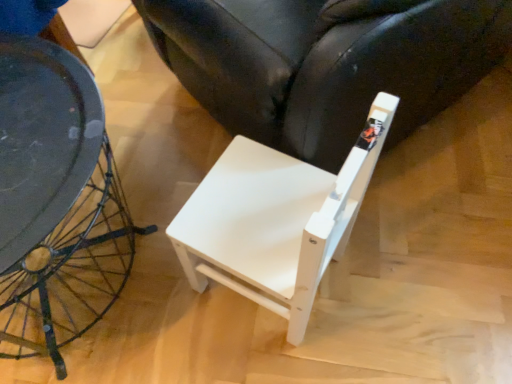
Locate an element on the screen. free area in between white matte chair at lower right, arranged as the 2th chair when ordered from the bottom, and white matte chair at center, the second chair viewed from the top is located at coordinates (356, 211).